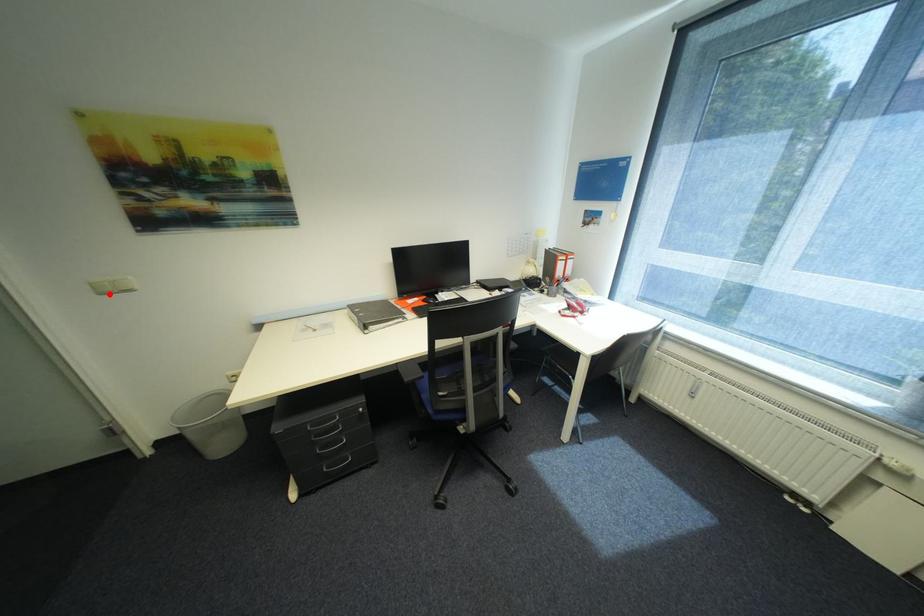
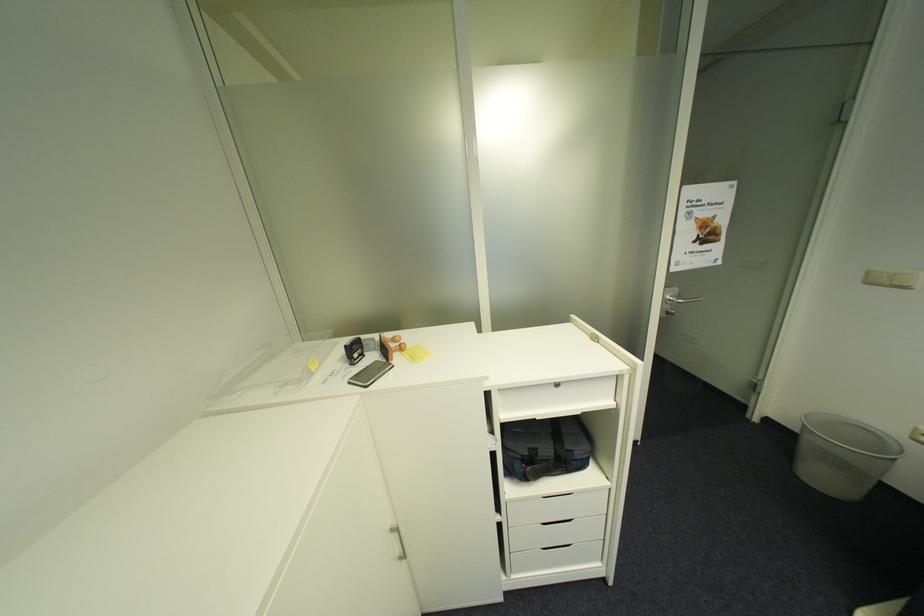
Locate, in the second image, the point that corresponds to the highlighted location in the first image.

(876, 284)